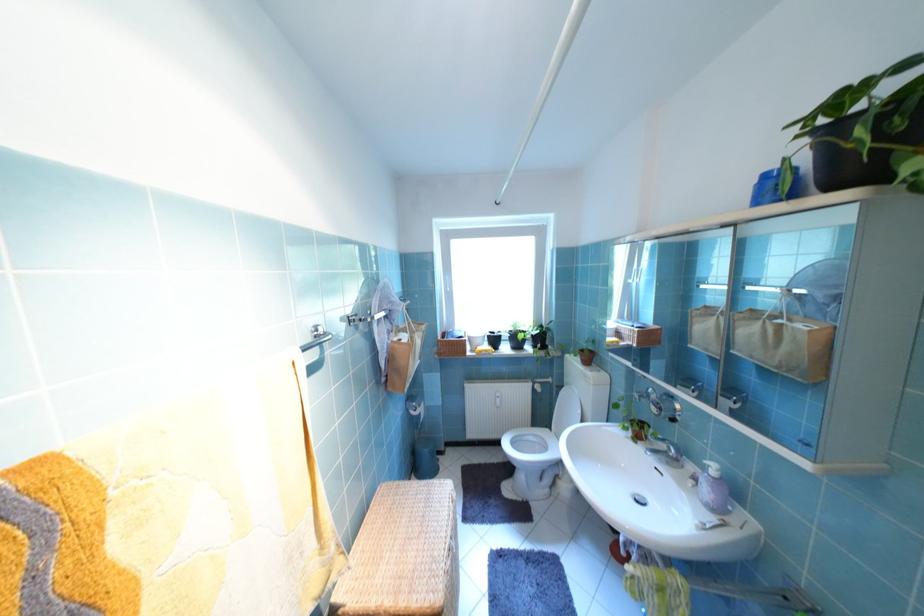
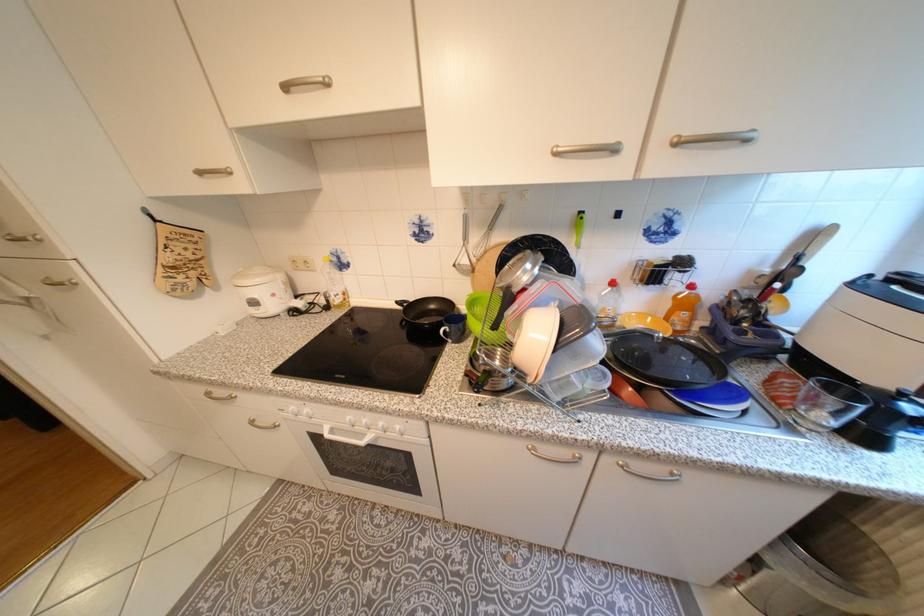
Question: I am providing you with two images of the same scene from different viewpoints. After the viewpoint changes to image2, which objects are now occluded?

Choices:
 (A) brown slipper
 (B) white rice cooker
 (C) black flower pot
 (D) silver cabinet handle

Answer: (C)